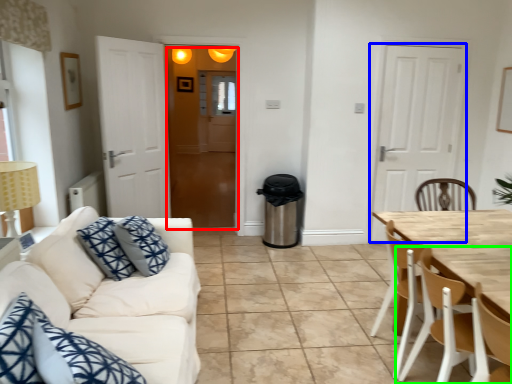
Question: Estimate the real-world distances between objects in this image. Which object is farther from glass door (highlighted by a red box), door (highlighted by a blue box) or chair (highlighted by a green box)?

Choices:
 (A) door
 (B) chair

Answer: (B)